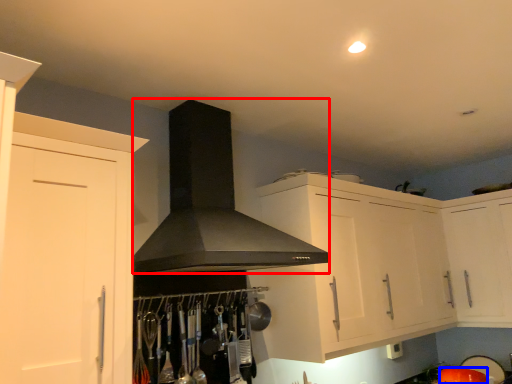
Question: Which of the following is the farthest to the observer, fume hood (highlighted by a red box) or appliance (highlighted by a blue box)?

Choices:
 (A) fume hood
 (B) appliance

Answer: (B)